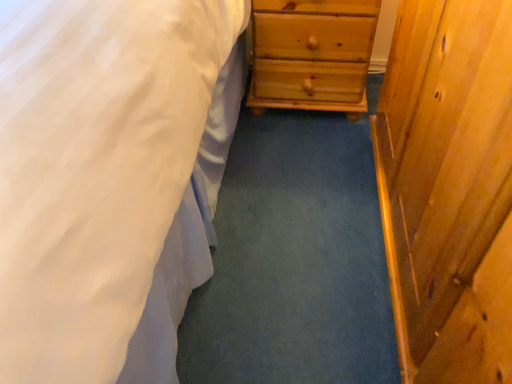
The width and height of the screenshot is (512, 384). Describe the element at coordinates (312, 54) in the screenshot. I see `light brown wooden chest of drawers at center` at that location.

At what (x,y) coordinates should I click in order to perform the action: click on light brown wooden chest of drawers at center. Please return your answer as a coordinate pair (x, y). Looking at the image, I should click on (312, 54).

Identify the location of light brown wooden chest of drawers at center. This screenshot has width=512, height=384. (312, 54).